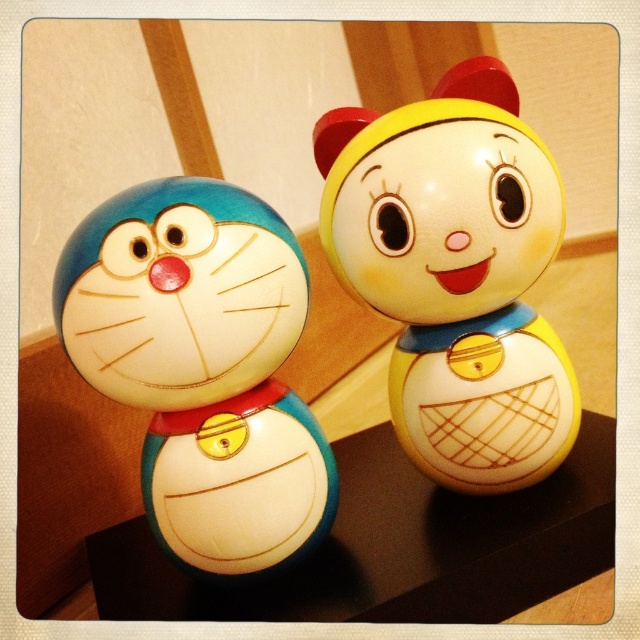
You are standing in front of the two ceramic figurines on the dark surface. You want to place a small vase between them. To ensure it fits, you need to know the spatial relationship between the two points. Is the first point, point (522, 404), located behind the second point, point (262, 448)?

Yes, point (522, 404) is behind point (262, 448), so placing the vase between them would require considering this spatial arrangement.

You are standing in front of a table with two ceramic figurines. The left one is Doraemon. The right one is at point (426, 237). Which figurine is closer to you?

The right one at point (426, 237) is closer to you as it is only 35.27 inches away from the viewer.